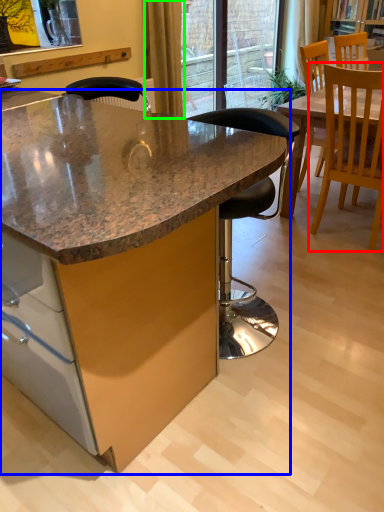
Question: Considering the real-world distances, which object is closest to chair (highlighted by a red box)? table (highlighted by a blue box) or curtain (highlighted by a green box).

Choices:
 (A) table
 (B) curtain

Answer: (A)